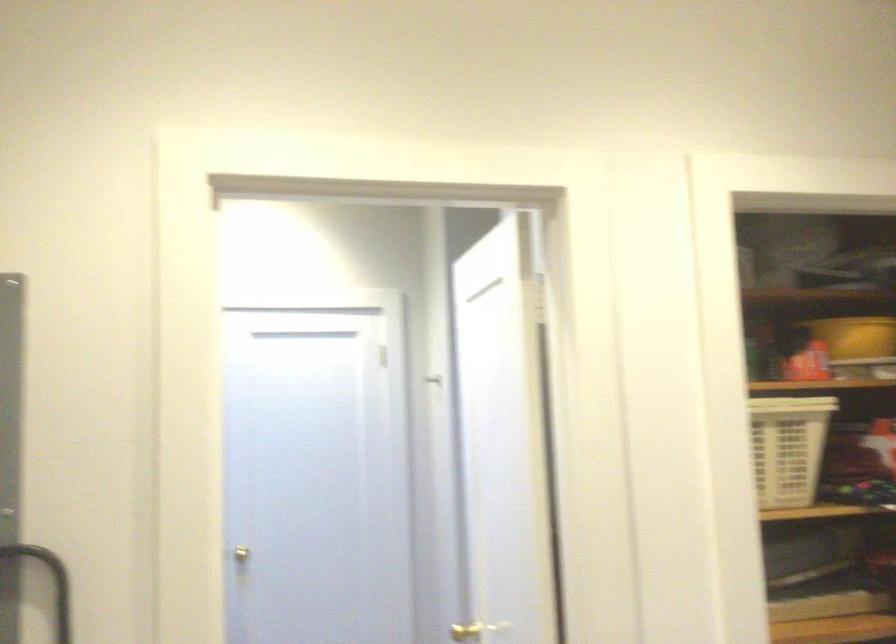
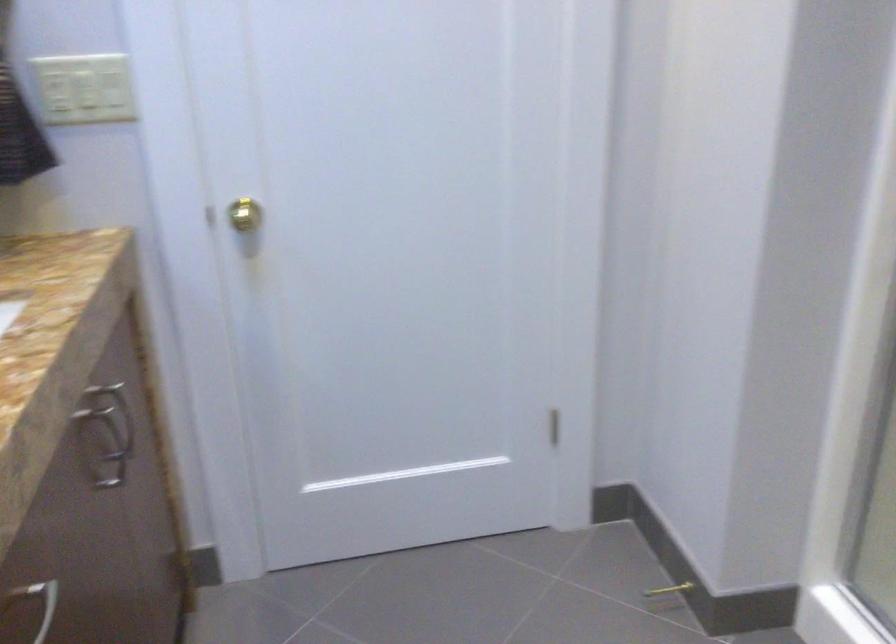
Question: What movement of the cameraman would produce the second image?

Choices:
 (A) Left
 (B) Right
 (C) Forward
 (D) Backward

Answer: (C)